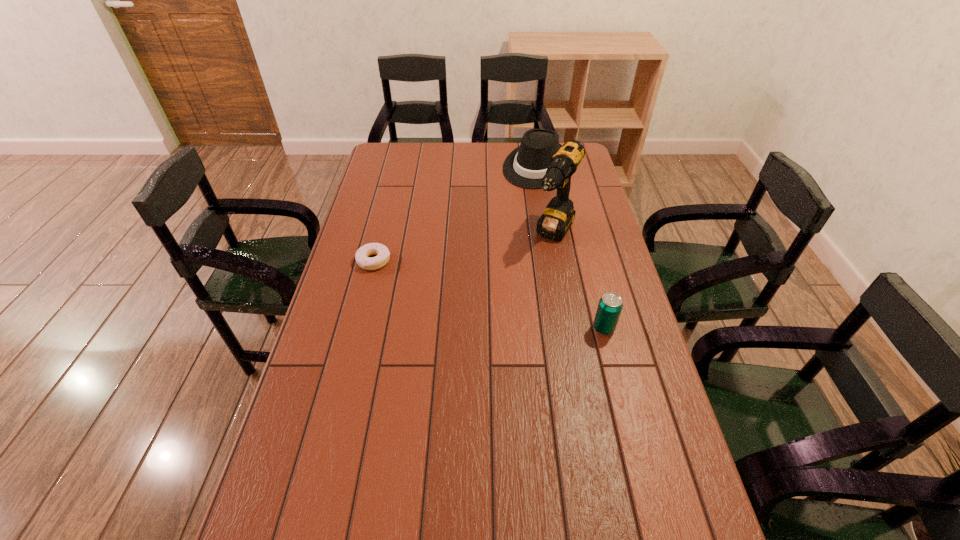
This screenshot has height=540, width=960. I want to click on vacant area between the farthest object and the drill, so click(546, 200).

Find the location of `free area in between the tallest object and the doughnut`. free area in between the tallest object and the doughnut is located at coordinates (465, 247).

The width and height of the screenshot is (960, 540). Identify the location of unoccupied position between the nearest object and the farthest object. (570, 247).

Locate an element on the screen. Image resolution: width=960 pixels, height=540 pixels. vacant point located between the fedora and the leftmost object is located at coordinates (456, 213).

Point out which object is positioned as the second nearest to the doughnut. Please provide its 2D coordinates. Your answer should be formatted as a tuple, i.e. [(x, y)], where the tuple contains the x and y coordinates of a point satisfying the conditions above.

[(526, 165)]

Where is `object that is the closest to the doughnut`? The width and height of the screenshot is (960, 540). object that is the closest to the doughnut is located at coordinates (556, 220).

This screenshot has width=960, height=540. I want to click on vacant space that satisfies the following two spatial constraints: 1. on the back side of the leftmost object; 2. on the left side of the fedora, so click(x=397, y=166).

Find the location of a particular element. The width and height of the screenshot is (960, 540). vacant space that satisfies the following two spatial constraints: 1. on the front side of the beer can; 2. on the right side of the doughnut is located at coordinates (357, 328).

I want to click on free spot that satisfies the following two spatial constraints: 1. on the front side of the fedora; 2. on the right side of the tallest object, so click(549, 234).